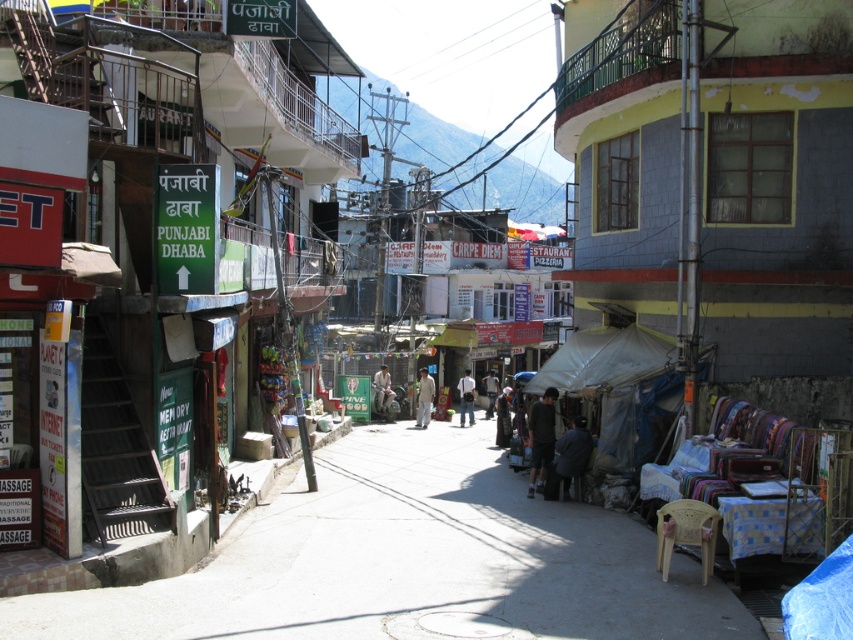
You are a tailor observing two fabrics on a table in the scene. The dark blue fabric at center and the light brown fabric pants at center are laid out. Which fabric has a taller height?

The dark blue fabric at center has a greater height compared to the light brown fabric pants at center.

You are a customer standing at the entrance of the Punjabi Dhaba. You notice two fabrics in the scene. Which fabric is nearer to you, the dark blue fabric at lower right or the light brown fabric pants at center?

The dark blue fabric at lower right is closer to the viewer than the light brown fabric pants at center.

You are a delivery person standing at the entrance of the Punjabi Dhaba. You need to deliver a package to a person wearing dark blue fabric at lower right and another to someone wearing light brown fabric pants at center. Which delivery location is closer to your current position?

Both delivery locations are 28.83 meters away from each other, so you need to check their individual distances from your current position at the Punjabi Dhaba entrance to determine which is closer.